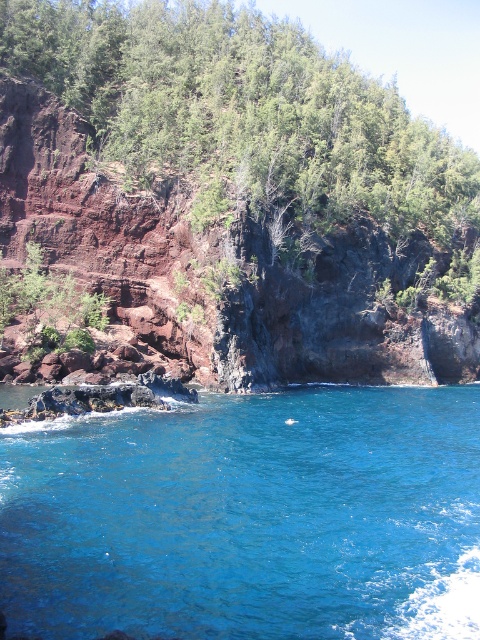
Question: Which point is closer to the camera?

Choices:
 (A) (6, 593)
 (B) (48, 36)

Answer: (A)

Question: Is blue liquid water at center above green leafy tree at upper center?

Choices:
 (A) no
 (B) yes

Answer: (A)

Question: Does blue liquid water at center have a greater width compared to green leafy tree at upper center?

Choices:
 (A) no
 (B) yes

Answer: (A)

Question: In this image, where is blue liquid water at center located relative to green leafy tree at upper center?

Choices:
 (A) above
 (B) below

Answer: (B)